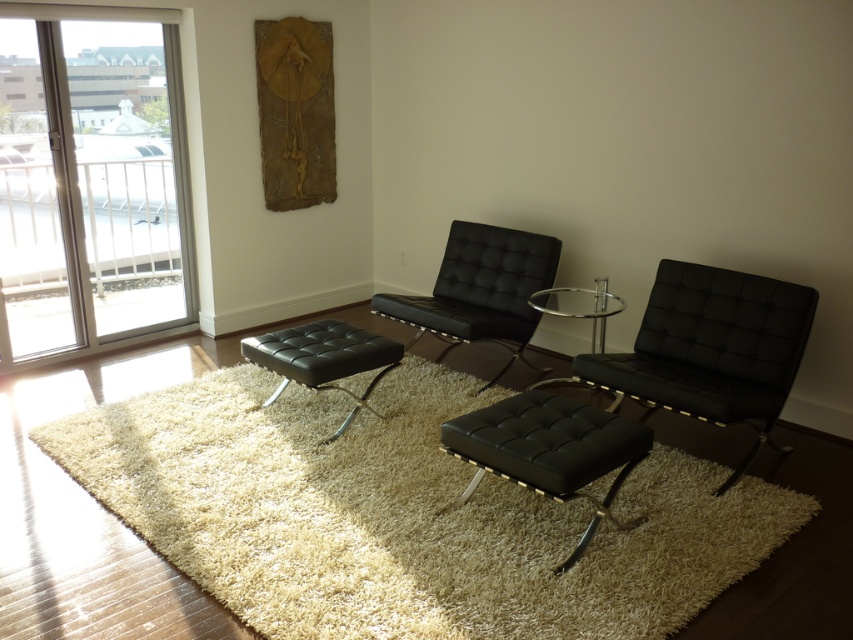
You are a delivery person trying to place a large package that measures 1.5 meters in length between the black leather armchair at right and the black leather ottoman at center. Can the package fit in the space between them without bending?

The distance between the black leather armchair at right and the black leather ottoman at center is 1.56 meters. Since the package is 1.5 meters long, it can fit in the space between them without bending.

You are moving a large potted plant into the living room and need to pass through the transparent glass door at left and then place it near the black leather ottoman at center. Considering their sizes, will the door be wide enough for the plant to fit through without tilting it sideways?

The transparent glass door at left is wider than the black leather ottoman at center. Since the ottoman can fit through the door, the potted plant should also be able to pass through without tilting, provided it is no wider than the ottoman.